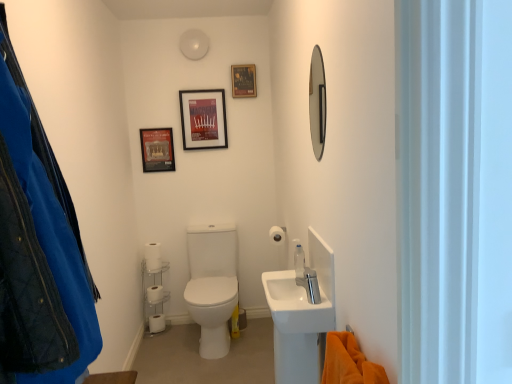
Question: Is white matte toilet paper at center, the fourth toilet paper from the left, aimed at white matte toilet paper at lower left, marked as the 3th toilet paper in a top-to-bottom arrangement?

Choices:
 (A) no
 (B) yes

Answer: (A)

Question: Is white matte toilet paper at center, the fourth toilet paper from the left, shorter than white matte toilet paper at lower left, placed as the fourth toilet paper when sorted from right to left?

Choices:
 (A) no
 (B) yes

Answer: (B)

Question: Considering the relative positions of white matte toilet paper at center, placed as the fourth toilet paper when sorted from back to front, and white matte toilet paper at lower left, which is counted as the 2th toilet paper, starting from the bottom, in the image provided, is white matte toilet paper at center, placed as the fourth toilet paper when sorted from back to front, to the left of white matte toilet paper at lower left, which is counted as the 2th toilet paper, starting from the bottom, from the viewer's perspective?

Choices:
 (A) no
 (B) yes

Answer: (A)

Question: Is white matte toilet paper at center, which ranks as the first toilet paper in top-to-bottom order, to the right of white matte toilet paper at lower left, marked as the 3th toilet paper in a top-to-bottom arrangement, from the viewer's perspective?

Choices:
 (A) no
 (B) yes

Answer: (B)

Question: Is white matte toilet paper at center, placed as the fourth toilet paper when sorted from back to front, directly adjacent to white matte toilet paper at lower left, which appears as the 3th toilet paper when viewed from the front?

Choices:
 (A) no
 (B) yes

Answer: (A)

Question: Considering the positions of white matte toilet paper at lower left, positioned as the 4th toilet paper in front-to-back order, and white plastic shelf at lower left in the image, is white matte toilet paper at lower left, positioned as the 4th toilet paper in front-to-back order, wider or thinner than white plastic shelf at lower left?

Choices:
 (A) thin
 (B) wide

Answer: (A)

Question: In the image, is white matte toilet paper at lower left, which is counted as the 4th toilet paper, starting from the top, positioned in front of or behind white plastic shelf at lower left?

Choices:
 (A) behind
 (B) front

Answer: (A)

Question: Which is correct: white matte toilet paper at lower left, positioned as the first toilet paper in bottom-to-top order, is inside white plastic shelf at lower left, or outside of it?

Choices:
 (A) inside
 (B) outside

Answer: (A)

Question: Based on their sizes in the image, would you say white matte toilet paper at lower left, positioned as the 4th toilet paper in front-to-back order, is bigger or smaller than white plastic shelf at lower left?

Choices:
 (A) small
 (B) big

Answer: (A)

Question: From their relative heights in the image, would you say matte plastic picture frame at upper center, the second picture frame positioned from the left, is taller or shorter than white matte toilet paper at lower left, the first toilet paper in the back-to-front sequence?

Choices:
 (A) tall
 (B) short

Answer: (A)

Question: From the image's perspective, relative to white matte toilet paper at lower left, the first toilet paper in the back-to-front sequence, is matte plastic picture frame at upper center, placed as the 2th picture frame when sorted from right to left, above or below?

Choices:
 (A) below
 (B) above

Answer: (B)

Question: In the image, is matte plastic picture frame at upper center, placed as the 2th picture frame when sorted from right to left, positioned in front of or behind white matte toilet paper at lower left, positioned as the first toilet paper in bottom-to-top order?

Choices:
 (A) front
 (B) behind

Answer: (A)

Question: Is point (180, 97) closer or farther from the camera than point (154, 327)?

Choices:
 (A) closer
 (B) farther

Answer: (A)

Question: Is matte plastic picture frame at upper center, the second picture frame positioned from the left, to the left or to the right of shiny silver mirror at upper right in the image?

Choices:
 (A) right
 (B) left

Answer: (B)

Question: Is point (188, 134) closer or farther from the camera than point (324, 89)?

Choices:
 (A) farther
 (B) closer

Answer: (A)